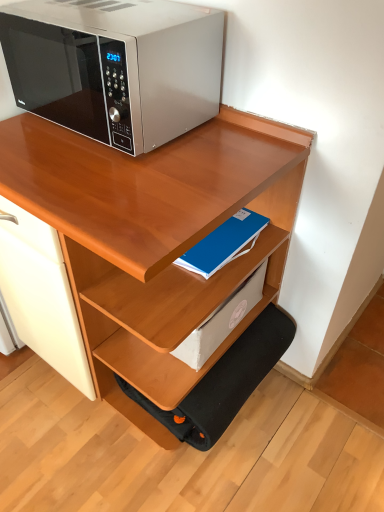
Question: Are blue matte notebook at center, the 1th paperback book viewed from the top, and blue matte paper at center, the second paperback book when ordered from top to bottom, far apart?

Choices:
 (A) no
 (B) yes

Answer: (A)

Question: Considering the relative sizes of blue matte notebook at center, positioned as the second paperback book in bottom-to-top order, and blue matte paper at center, the second paperback book when ordered from top to bottom, in the image provided, is blue matte notebook at center, positioned as the second paperback book in bottom-to-top order, wider than blue matte paper at center, the second paperback book when ordered from top to bottom,?

Choices:
 (A) yes
 (B) no

Answer: (A)

Question: Does blue matte notebook at center, positioned as the second paperback book in bottom-to-top order, have a lesser height compared to blue matte paper at center, the second paperback book when ordered from top to bottom?

Choices:
 (A) yes
 (B) no

Answer: (A)

Question: Is blue matte paper at center, acting as the 1th paperback book starting from the bottom, at the back of blue matte notebook at center, positioned as the second paperback book in bottom-to-top order?

Choices:
 (A) no
 (B) yes

Answer: (A)

Question: From a real-world perspective, is blue matte notebook at center, positioned as the second paperback book in bottom-to-top order, located higher than blue matte paper at center, acting as the 1th paperback book starting from the bottom?

Choices:
 (A) yes
 (B) no

Answer: (A)

Question: Is wooden desk at upper center bigger or smaller than satin silver microwave at upper left?

Choices:
 (A) big
 (B) small

Answer: (A)

Question: From the image's perspective, relative to satin silver microwave at upper left, is wooden desk at upper center above or below?

Choices:
 (A) above
 (B) below

Answer: (B)

Question: Is point (46, 181) closer or farther from the camera than point (34, 95)?

Choices:
 (A) farther
 (B) closer

Answer: (B)

Question: Is wooden desk at upper center in front of or behind satin silver microwave at upper left in the image?

Choices:
 (A) front
 (B) behind

Answer: (A)

Question: From the image's perspective, is black fabric step stool at lower center located above or below satin silver microwave at upper left?

Choices:
 (A) above
 (B) below

Answer: (B)

Question: From their relative heights in the image, would you say black fabric step stool at lower center is taller or shorter than satin silver microwave at upper left?

Choices:
 (A) tall
 (B) short

Answer: (B)

Question: Considering the positions of point (221, 389) and point (122, 116), is point (221, 389) closer or farther from the camera than point (122, 116)?

Choices:
 (A) closer
 (B) farther

Answer: (B)

Question: In the image, is black fabric step stool at lower center positioned in front of or behind satin silver microwave at upper left?

Choices:
 (A) behind
 (B) front

Answer: (A)

Question: Considering the positions of satin silver microwave at upper left and black fabric step stool at lower center in the image, is satin silver microwave at upper left taller or shorter than black fabric step stool at lower center?

Choices:
 (A) tall
 (B) short

Answer: (A)

Question: Considering the positions of point (183, 52) and point (193, 389), is point (183, 52) closer or farther from the camera than point (193, 389)?

Choices:
 (A) closer
 (B) farther

Answer: (A)